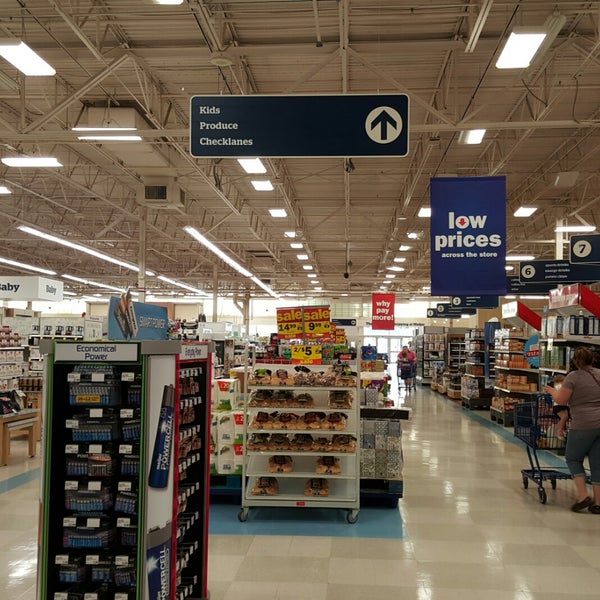
This screenshot has height=600, width=600. What are the coordinates of `floor` in the screenshot? It's located at (456, 495).